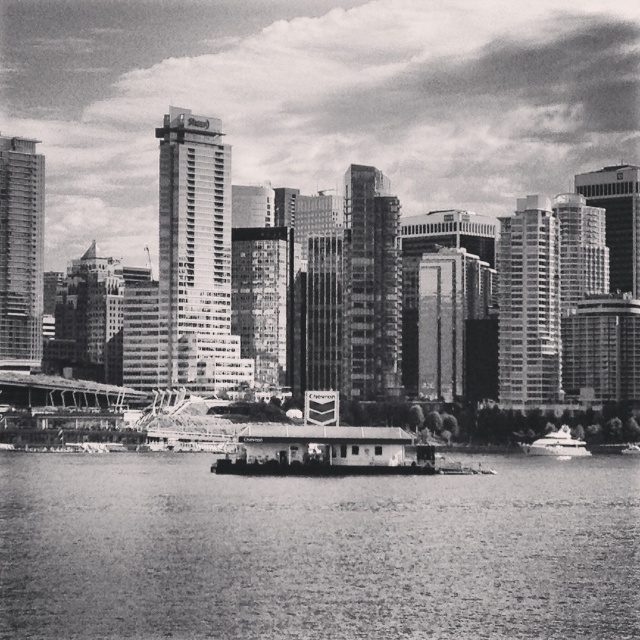
You are a photographer standing at the edge of the water. You want to capture a photo of the smooth water at center and the white glossy boat at lower right in the same frame. Based on their positions, which object should you pan your camera towards first to include both in the shot?

Since the smooth water at center is to the left of the white glossy boat at lower right, you should pan your camera towards the smooth water at center first to ensure both objects are included in the frame.